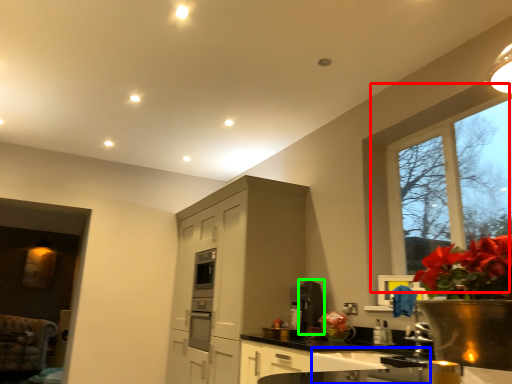
Question: Which is farther away from window (highlighted by a red box)? sink (highlighted by a blue box) or appliance (highlighted by a green box)?

Choices:
 (A) sink
 (B) appliance

Answer: (A)